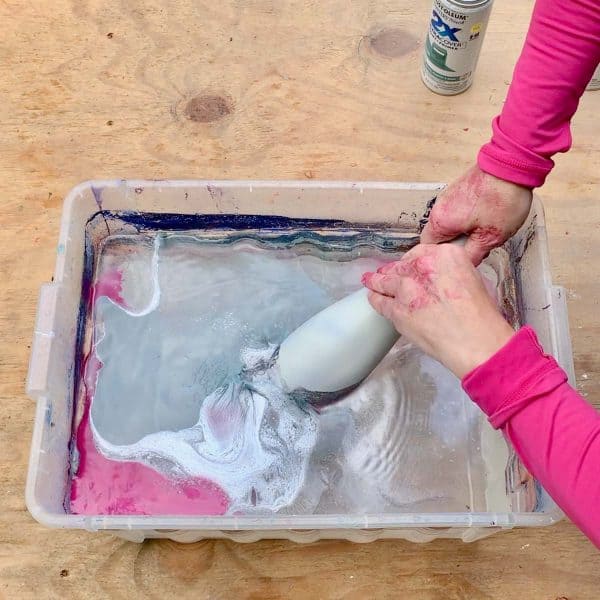
Locate an element on the screen. handle is located at coordinates (463, 245).